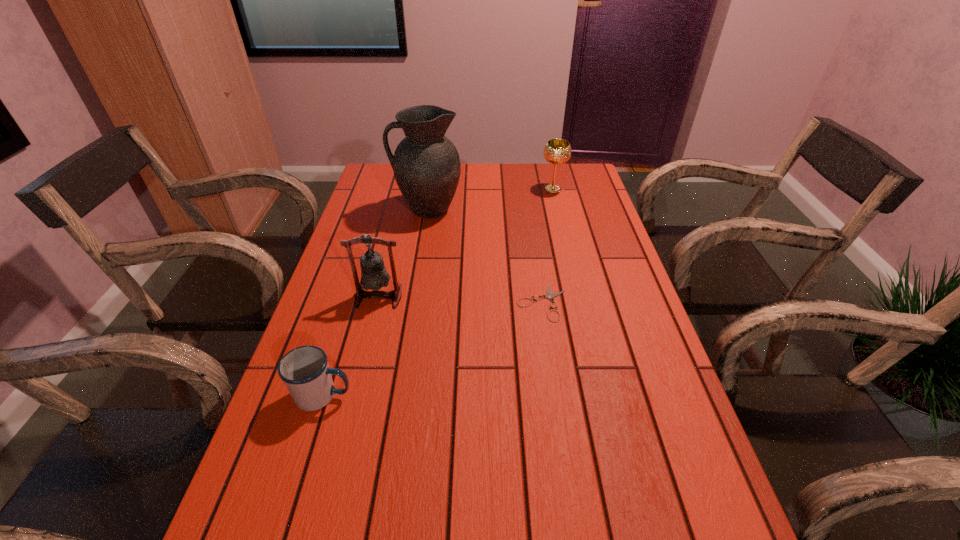
Where is `free space between the shears and the third shortest object`? free space between the shears and the third shortest object is located at coordinates (547, 246).

Where is `vacant point located between the tallest object and the bell`? Image resolution: width=960 pixels, height=540 pixels. vacant point located between the tallest object and the bell is located at coordinates (403, 253).

The image size is (960, 540). I want to click on unoccupied area between the shortest object and the tallest object, so click(x=485, y=256).

Where is `free area in between the mug and the shears`? The image size is (960, 540). free area in between the mug and the shears is located at coordinates (433, 349).

Locate an element on the screen. the closest object to the third shortest object is located at coordinates (426, 164).

Locate an element on the screen. This screenshot has height=540, width=960. object that can be found as the fourth closest to the mug is located at coordinates (557, 151).